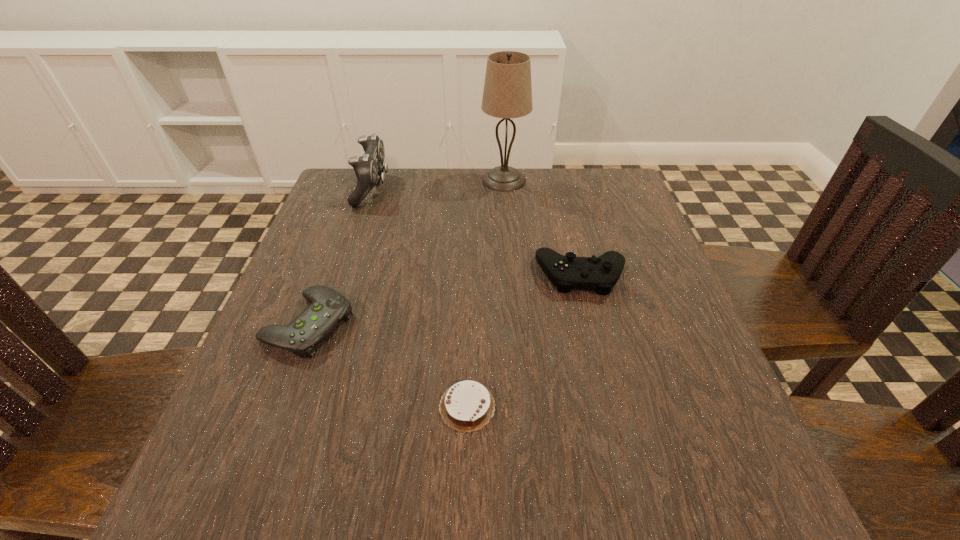
Locate an element on the screen. This screenshot has width=960, height=540. free space at the near edge of the desktop is located at coordinates (429, 478).

Identify the location of blank space at the left edge. Image resolution: width=960 pixels, height=540 pixels. (289, 397).

In the image, there is a desktop. What are the coordinates of `free region at the right edge` in the screenshot? It's located at (618, 230).

This screenshot has height=540, width=960. In order to click on vacant space at the far left corner of the desktop in this screenshot , I will do `click(356, 175)`.

The height and width of the screenshot is (540, 960). What are the coordinates of `free space between the rightmost control and the second tallest object` in the screenshot? It's located at (477, 232).

Where is `vacant point located between the lampshade and the nearest object`? The width and height of the screenshot is (960, 540). vacant point located between the lampshade and the nearest object is located at coordinates (486, 293).

Where is `empty space between the tallest control and the shortest control`? empty space between the tallest control and the shortest control is located at coordinates (341, 256).

Image resolution: width=960 pixels, height=540 pixels. What are the coordinates of `free space between the fourth tallest object and the lampshade` in the screenshot? It's located at (406, 252).

I want to click on free spot between the second tallest object and the nearest object, so click(x=420, y=298).

What are the coordinates of `free spot between the second tallest object and the nearest object` in the screenshot? It's located at (420, 298).